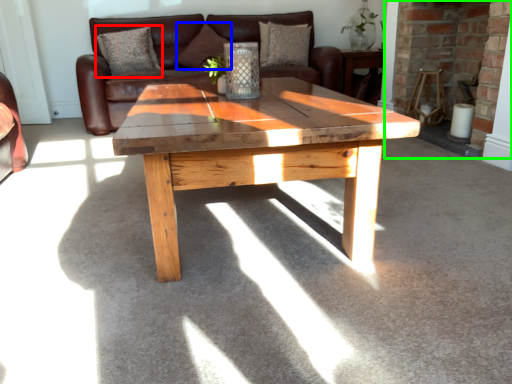
Question: Considering the real-world distances, which object is farthest from pillow (highlighted by a red box)? pillow (highlighted by a blue box) or fireplace (highlighted by a green box)?

Choices:
 (A) pillow
 (B) fireplace

Answer: (B)